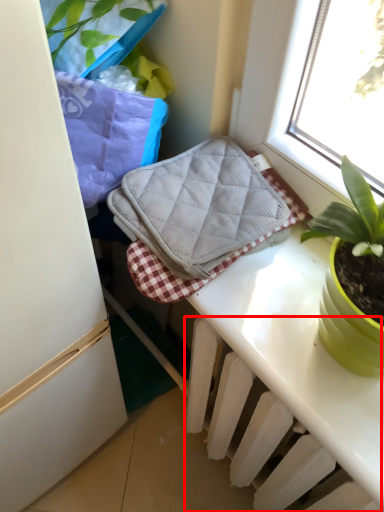
Question: Observing the image, what is the correct spatial positioning of radiator (annotated by the red box) in reference to bath towel?

Choices:
 (A) right
 (B) left

Answer: (A)